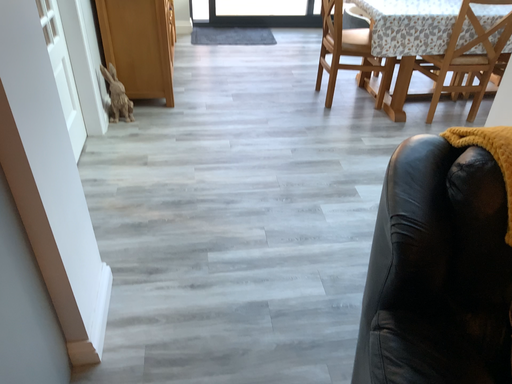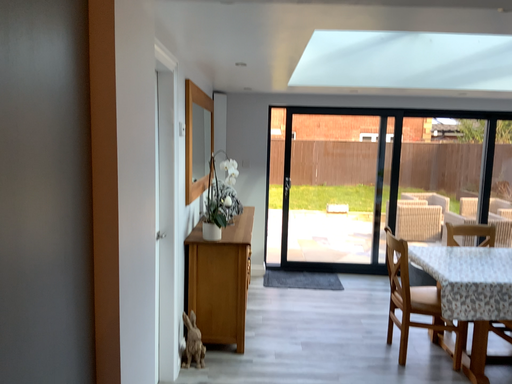
Question: How did the camera likely rotate when shooting the video?

Choices:
 (A) rotated right
 (B) rotated left

Answer: (B)